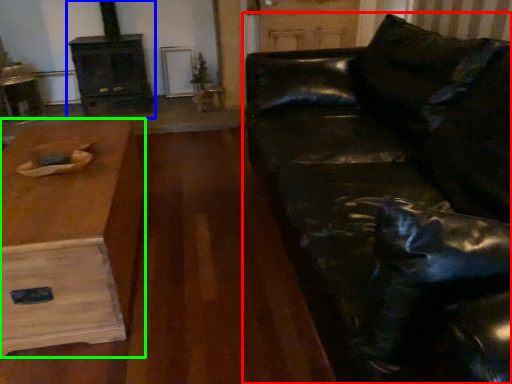
Question: Which object is the farthest from studio couch (highlighted by a red box)? Choose among these: fireplace (highlighted by a blue box) or table (highlighted by a green box).

Choices:
 (A) fireplace
 (B) table

Answer: (A)